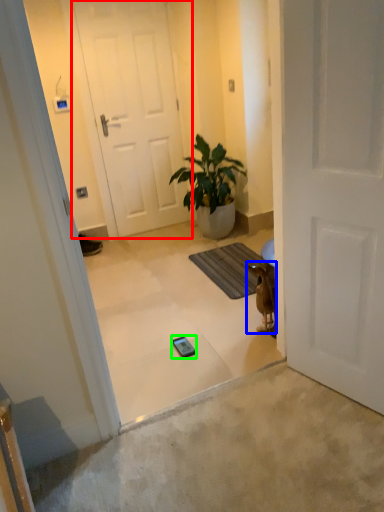
Question: Based on their relative distances, which object is farther from door (highlighted by a red box)? Choose from animal (highlighted by a blue box) and mobile phone (highlighted by a green box).

Choices:
 (A) animal
 (B) mobile phone

Answer: (B)